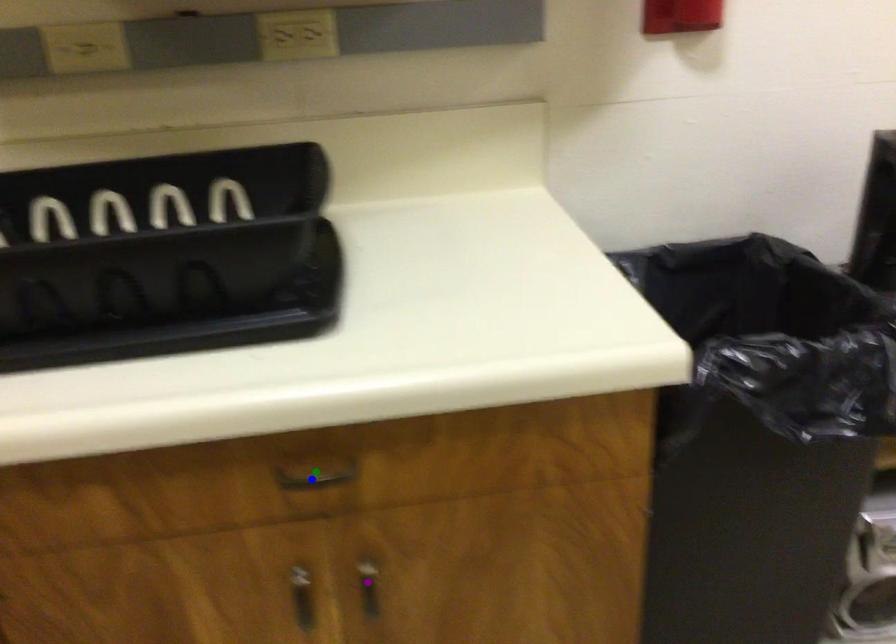
Order these from nearest to farthest:
- purple point
- green point
- blue point

green point
blue point
purple point